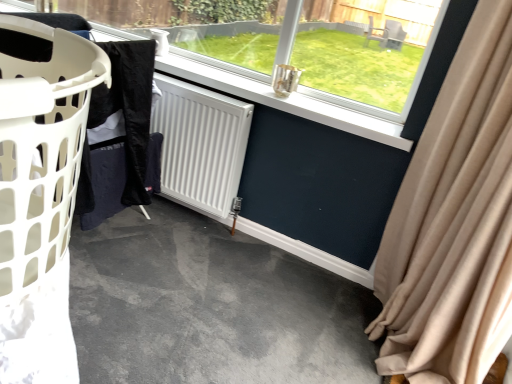
Question: Considering the positions of black fabric at left and white matte radiator at center in the image, is black fabric at left taller or shorter than white matte radiator at center?

Choices:
 (A) tall
 (B) short

Answer: (B)

Question: Is black fabric at left inside or outside of white matte radiator at center?

Choices:
 (A) inside
 (B) outside

Answer: (B)

Question: Which of these objects is positioned farthest from the gray concrete floor at lower left?

Choices:
 (A) white matte radiator at center
 (B) transparent glass window at center
 (C) black fabric at left
 (D) beige fabric curtain at right
 (E) white plastic laundry basket at left

Answer: (E)

Question: Based on their relative distances, which object is nearer to the beige fabric curtain at right?

Choices:
 (A) gray concrete floor at lower left
 (B) white plastic laundry basket at left
 (C) black fabric at left
 (D) white matte radiator at center
 (E) transparent glass window at center

Answer: (E)